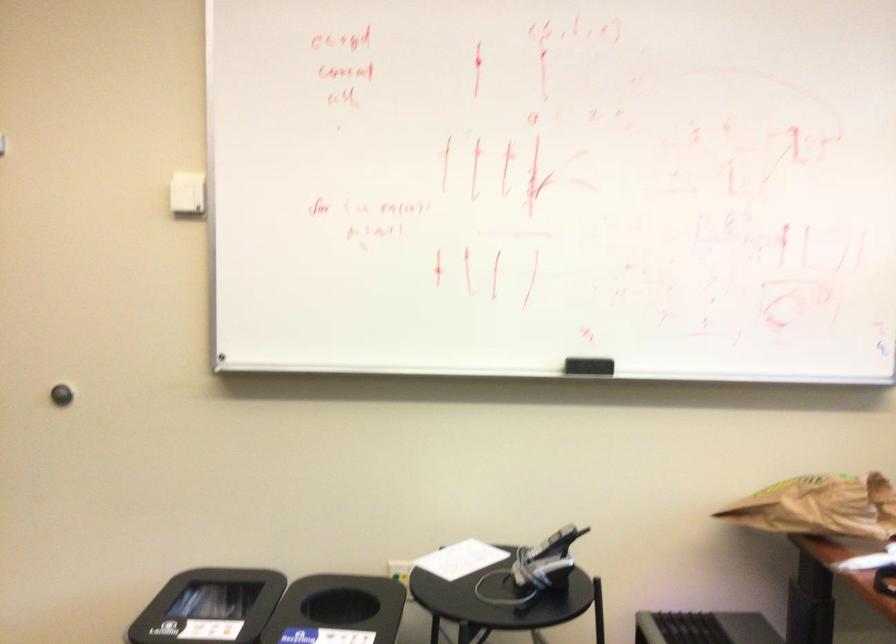
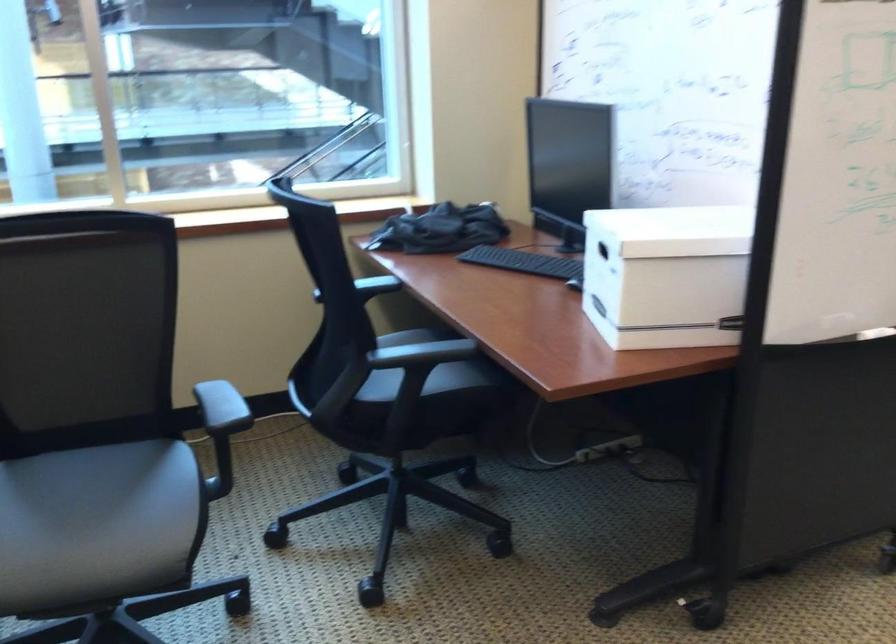
Based on the continuous images, in which direction is the camera rotating?

The camera's rotation is toward right-down.